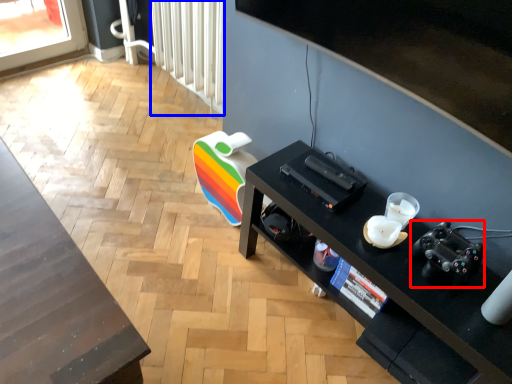
Question: Which of the following is the farthest to the observer, video camera (highlighted by a red box) or radiator (highlighted by a blue box)?

Choices:
 (A) video camera
 (B) radiator

Answer: (B)